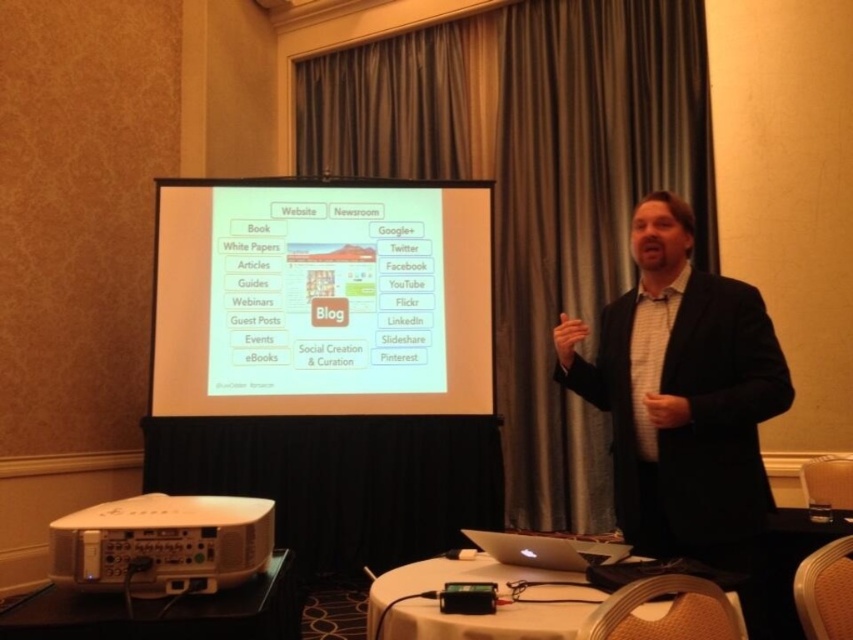
You are a technician who needs to adjust the white plastic projector at lower left so that it aligns with the camera. The minimum distance required between the projector and camera for proper alignment is 1.5 meters. Is the current distance sufficient?

The white plastic projector at lower left and camera are 1.41 meters apart from each other. Since 1.41 meters is less than the required 1.5 meters, the current distance is insufficient for proper alignment.

You are an attendee at this presentation and need to take a photo of the slide on the white matte projection screen at center. Your silver metallic laptop at center has a camera that can capture objects up to 3 meters away. Can you capture the slide clearly without moving closer?

The white matte projection screen at center is taller than the silver metallic laptop at center, but the distance required to capture the slide clearly depends on the screen size and camera quality. Since the laptop camera can capture up to 3 meters, if the attendee is within that range, the slide should be visible. However, the question does not provide the exact distance between the attendee and the screen, so we cannot confirm clarity without that information.

You are a technician who needs to set up a laptop 2 meters away from the projection screen to ensure proper connectivity. Can you place the silver metallic laptop at center so that it is exactly 2 meters away from the white matte projection screen at center?

The white matte projection screen at center is 2.10 meters from the silver metallic laptop at center. Since 2.10 meters is slightly more than 2 meters, placing the silver metallic laptop at center would result in it being just over the required distance. Therefore, it might not meet the exact 2 meters needed for proper connectivity.